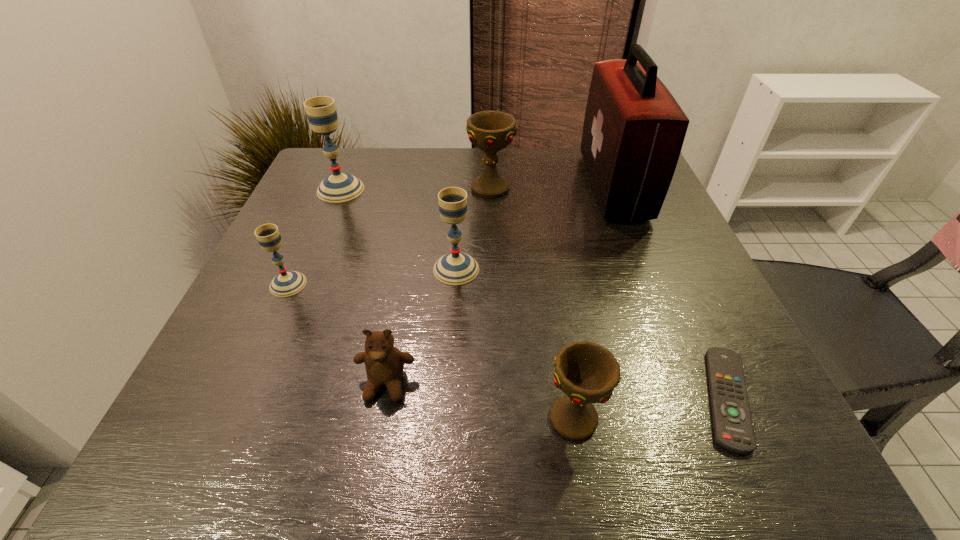
Image resolution: width=960 pixels, height=540 pixels. Identify the location of the second shortest object. (384, 363).

In order to click on the sixth object from right to left in this screenshot , I will do `click(384, 363)`.

Locate an element on the screen. the shortest object is located at coordinates (733, 429).

This screenshot has height=540, width=960. I want to click on vacant space located on the side of the red first aid kit with the cross symbol, so click(532, 186).

You are a GUI agent. You are given a task and a screenshot of the screen. Output one action in this format:
    pyautogui.click(x=<x>, y=<y>)
    Task: Click on the free space located 0.180m on the side of the red first aid kit with the cross symbol
    The height and width of the screenshot is (540, 960).
    Given the screenshot: What is the action you would take?
    pyautogui.click(x=516, y=186)

Identify the location of vacant space situated 0.300m on the side of the red first aid kit with the cross symbol. This screenshot has height=540, width=960. (469, 186).

I want to click on free space located 0.120m on the front of the farthest gray chalice, so click(323, 233).

Locate an element on the screen. The width and height of the screenshot is (960, 540). free space located on the right of the bigger red chalice is located at coordinates (549, 188).

Locate an element on the screen. Image resolution: width=960 pixels, height=540 pixels. free location located 0.270m on the front of the rightmost gray chalice is located at coordinates (448, 409).

Where is `vacant point located 0.250m on the front of the smallest gray chalice`? This screenshot has width=960, height=540. vacant point located 0.250m on the front of the smallest gray chalice is located at coordinates (229, 417).